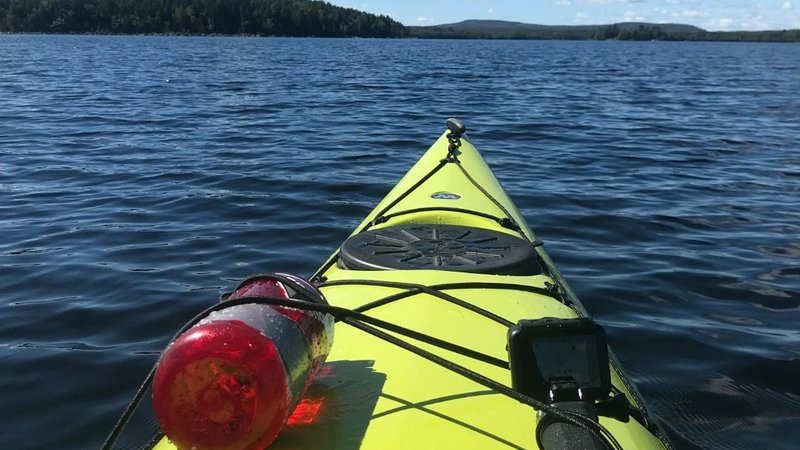
Identify the location of black cords / cables or ropes. (445, 347), (465, 303), (390, 280), (445, 205).